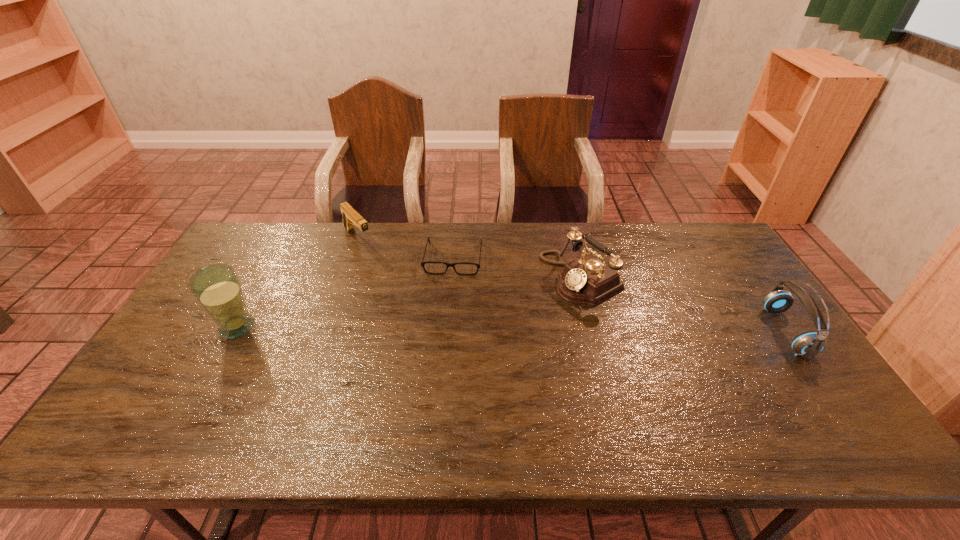
At what (x,y) coordinates should I click in order to perform the action: click on object at the left edge. Please return your answer as a coordinate pair (x, y). This screenshot has width=960, height=540. Looking at the image, I should click on (217, 288).

Find the location of a particular element. object at the right edge is located at coordinates (x=807, y=345).

The image size is (960, 540). Identify the location of free space at the far edge of the desktop. (455, 241).

In the image, there is a desktop. At what (x,y) coordinates should I click in order to perform the action: click on vacant region at the near edge. Please return your answer as a coordinate pair (x, y). The height and width of the screenshot is (540, 960). Looking at the image, I should click on (442, 397).

In the image, there is a desktop. At what (x,y) coordinates should I click in order to perform the action: click on vacant space at the left edge. Please return your answer as a coordinate pair (x, y). The image size is (960, 540). Looking at the image, I should click on point(204,330).

Identify the location of blank space at the right edge of the desktop. (717, 298).

The image size is (960, 540). Find the location of `free space at the far left corner`. free space at the far left corner is located at coordinates (274, 233).

Identify the location of free space that is in between the rightmost object and the shortest object. (619, 295).

At what (x,y) coordinates should I click in order to perform the action: click on free space that is in between the glass and the second shortest object. Please return your answer as a coordinate pair (x, y). Image resolution: width=960 pixels, height=540 pixels. Looking at the image, I should click on (298, 283).

Find the location of `unoccupied position between the fourth object from left to right and the spectacles`. unoccupied position between the fourth object from left to right and the spectacles is located at coordinates (517, 268).